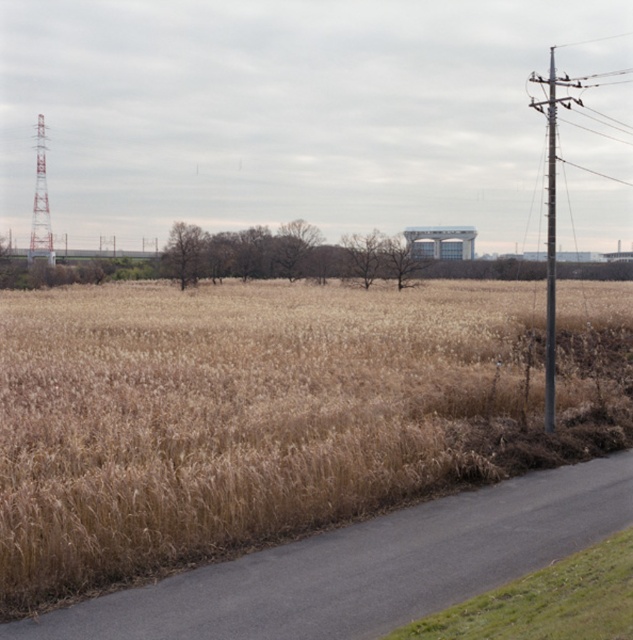
Does brown grassy field at center have a smaller size compared to metallic gray telegraph pole at right?

Correct, brown grassy field at center occupies less space than metallic gray telegraph pole at right.

Looking at this image, can you confirm if brown grassy field at center is bigger than metallic gray telegraph pole at right?

No, brown grassy field at center is not bigger than metallic gray telegraph pole at right.

Is point (508, 387) in front of point (551, 312)?

No, it is not.

Find the location of `brown grassy field at center`. brown grassy field at center is located at coordinates (273, 413).

Can you confirm if brown grassy field at center is bigger than white painted metal tower at left?

No.

Which is in front, point (127, 394) or point (47, 220)?

Point (127, 394)

Where is `brown grassy field at center`? The width and height of the screenshot is (633, 640). brown grassy field at center is located at coordinates (273, 413).

Can you confirm if metallic gray telegraph pole at right is positioned above white painted metal tower at left?

Actually, metallic gray telegraph pole at right is below white painted metal tower at left.

Measure the distance from metallic gray telegraph pole at right to white painted metal tower at left.

The distance of metallic gray telegraph pole at right from white painted metal tower at left is 235.41 feet.

This screenshot has width=633, height=640. I want to click on metallic gray telegraph pole at right, so click(549, 225).